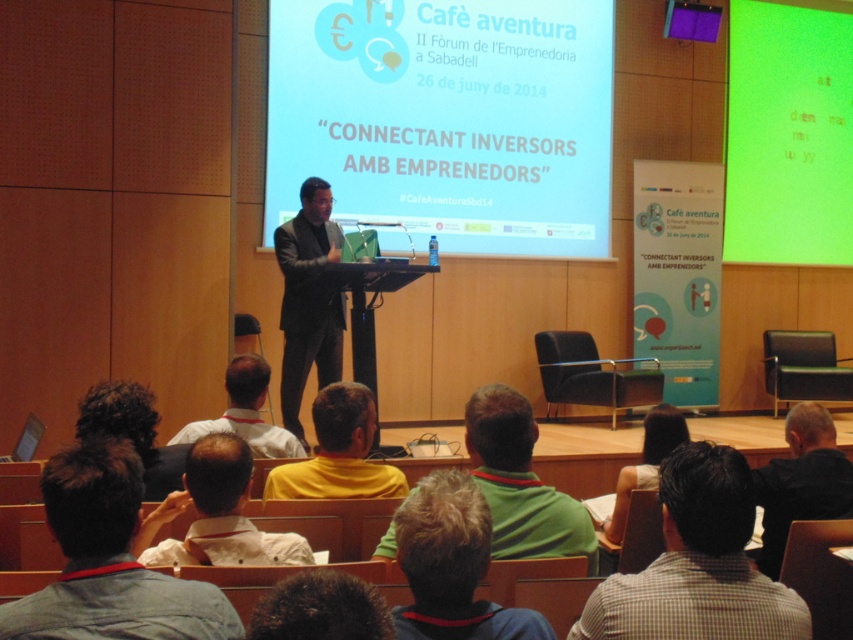
You are sitting in the audience and want to focus on the presentation. Which object should you look at first, the matte white projector screen at center or the yellow matte shirt at center?

You should look at the yellow matte shirt at center first because the matte white projector screen at center is positioned on its right side, meaning the yellow matte shirt at center is closer to your left and likely the speaker.

You are an attendee sitting in the front row of the conference hall. You notice the yellow matte shirt at center and the matte white projector screen at center. Which object is closer to you?

The matte white projector screen at center is closer to you because the yellow matte shirt at center is behind it.